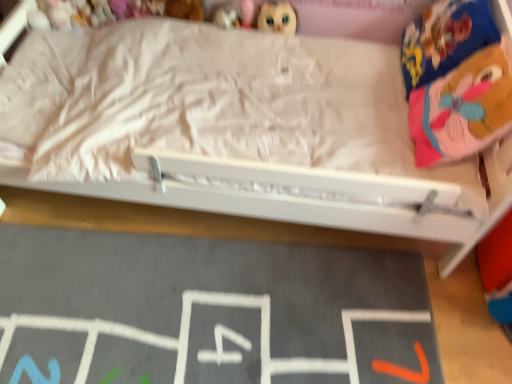
I want to click on free point above black chalkboard at lower center (from a real-world perspective), so click(x=202, y=309).